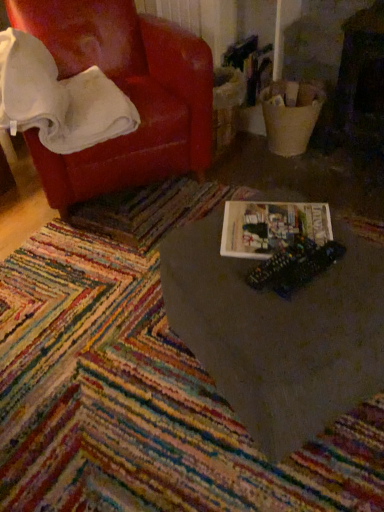
You are a GUI agent. You are given a task and a screenshot of the screen. Output one action in this format:
    pyautogui.click(x=<x>, y=<y>)
    Task: Click on the vacant point above hardcover book at center (from a real-world perspective)
    
    Given the screenshot: What is the action you would take?
    click(x=282, y=225)